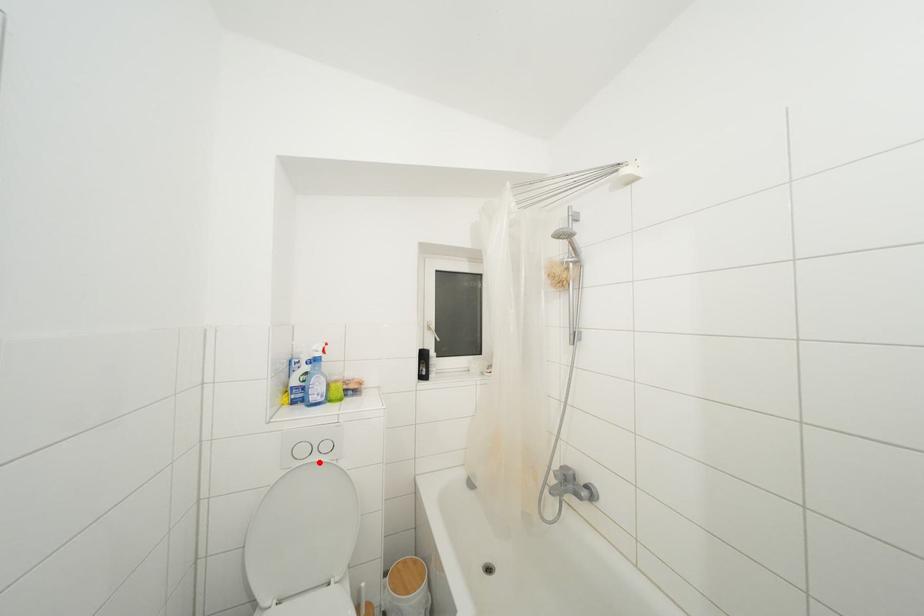
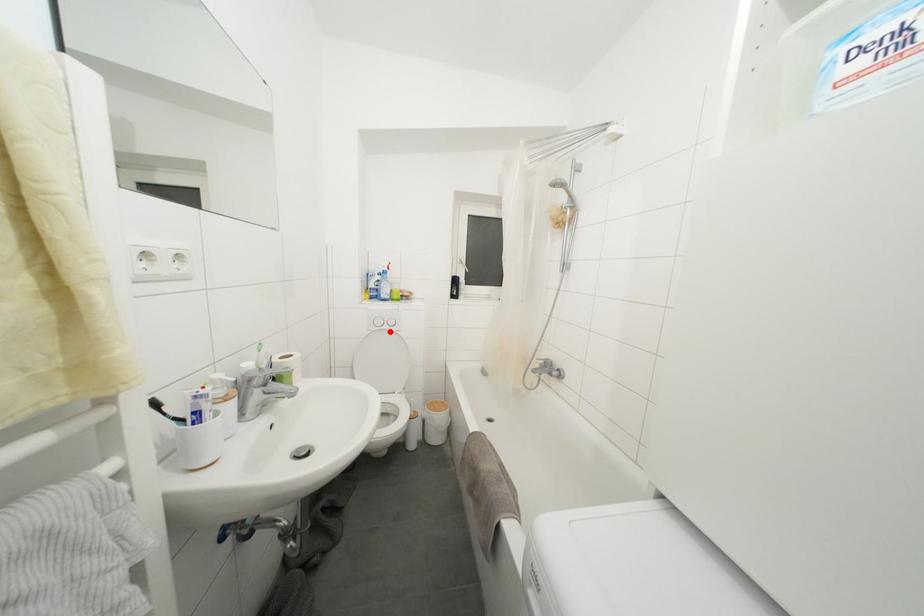
I am providing you with two images of the same scene from different viewpoints. A red point is marked on the first image and another point is marked on the second image. Do the highlighted points in image1 and image2 indicate the same real-world spot?

Yes